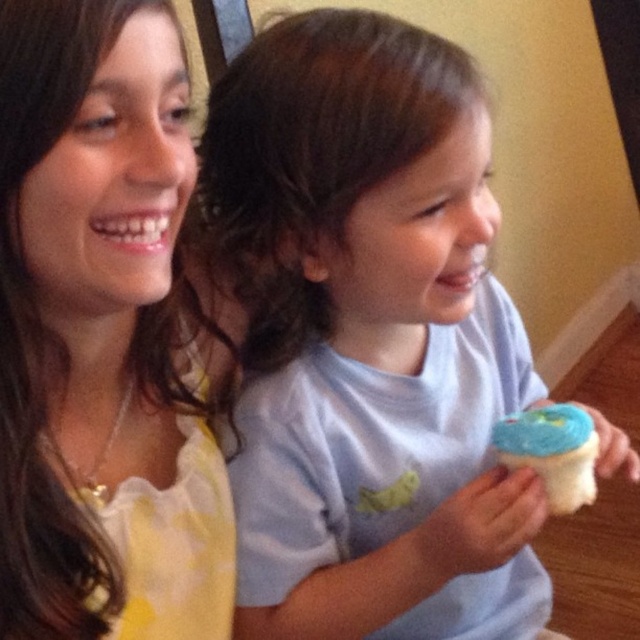
Question: Considering the real-world distances, which object is farthest from the white matte cupcake at center?

Choices:
 (A) blue frosting cupcake at right
 (B) matte yellow shirt at upper left

Answer: (A)

Question: Can you confirm if white matte cupcake at center is positioned to the left of matte yellow shirt at upper left?

Choices:
 (A) no
 (B) yes

Answer: (A)

Question: Does white matte cupcake at center appear on the left side of matte yellow shirt at upper left?

Choices:
 (A) yes
 (B) no

Answer: (B)

Question: Which point appears closest to the camera in this image?

Choices:
 (A) (502, 438)
 (B) (321, 195)

Answer: (B)

Question: Is white matte cupcake at center to the left of matte yellow shirt at upper left from the viewer's perspective?

Choices:
 (A) no
 (B) yes

Answer: (A)

Question: Estimate the real-world distances between objects in this image. Which object is farther from the white matte cupcake at center?

Choices:
 (A) blue frosting cupcake at right
 (B) matte yellow shirt at upper left

Answer: (A)